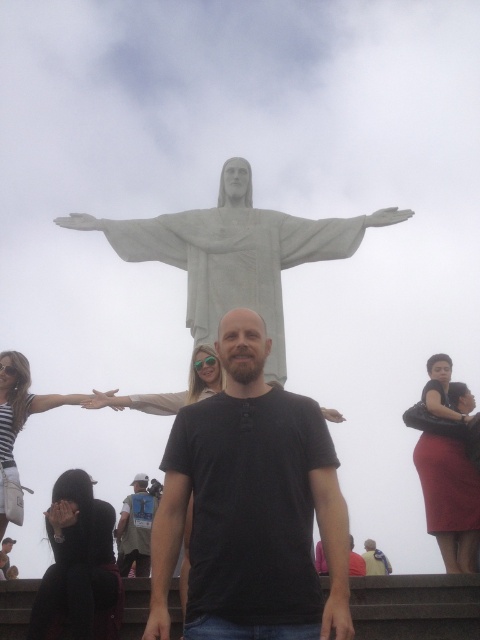
Question: Among these objects, which one is farthest from the camera?

Choices:
 (A) black matte shirt at center
 (B) black cotton t-shirt at center

Answer: (B)

Question: Is white stone statue at upper center smaller than striped fabric shirt at lower left?

Choices:
 (A) no
 (B) yes

Answer: (A)

Question: Does black matte shirt at center have a larger size compared to black matte arm at center?

Choices:
 (A) yes
 (B) no

Answer: (B)

Question: Does black cotton t-shirt at center lie in front of black matte arm at center?

Choices:
 (A) yes
 (B) no

Answer: (A)

Question: Estimate the real-world distances between objects in this image. Which object is farther from the black matte arm at center?

Choices:
 (A) light brown leather jacket at center
 (B) white stone statue at upper center
 (C) black matte shirt at center
 (D) white marble statue arm at upper center

Answer: (D)

Question: Which point is farther from the camera taking this photo?

Choices:
 (A) (330, 566)
 (B) (11, 451)
 (C) (452, 468)
 (D) (159, 632)

Answer: (B)